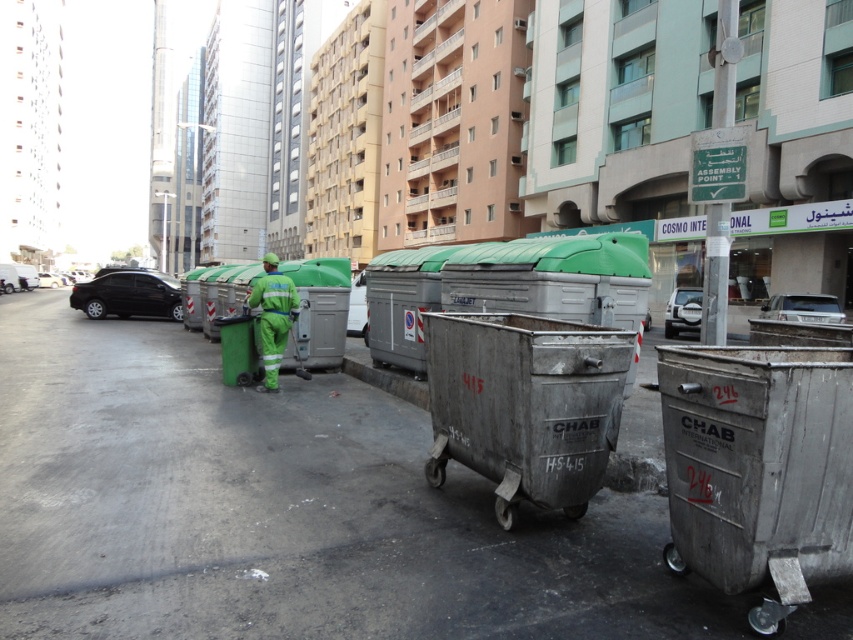
Is gray metallic trash can at right above metallic gray recycling bin at center?

No.

Find the location of a particular element. gray metallic trash can at right is located at coordinates (758, 468).

Find the location of `gray metallic trash can at right`. gray metallic trash can at right is located at coordinates (758, 468).

Which is more to the right, metallic gray recycling bin at center or green plastic garbage at center?

Positioned to the right is metallic gray recycling bin at center.

Is metallic gray recycling bin at center behind green plastic garbage at center?

No.

The width and height of the screenshot is (853, 640). I want to click on metallic gray recycling bin at center, so click(x=525, y=404).

Is metallic pavement at center wider than metallic gray recycling bin at center?

Yes, metallic pavement at center is wider than metallic gray recycling bin at center.

Image resolution: width=853 pixels, height=640 pixels. Find the location of `metallic pavement at center`. metallic pavement at center is located at coordinates (281, 509).

Measure the distance between metallic pavement at center and camera.

metallic pavement at center and camera are 3.08 meters apart from each other.

Identify the location of metallic pavement at center. (281, 509).